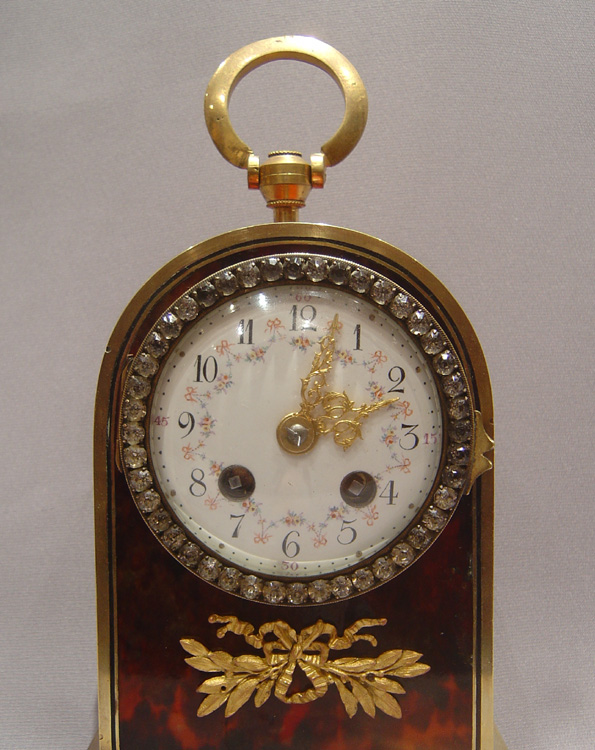
This screenshot has height=750, width=595. Find the location of `gray wall`. gray wall is located at coordinates tap(173, 204).